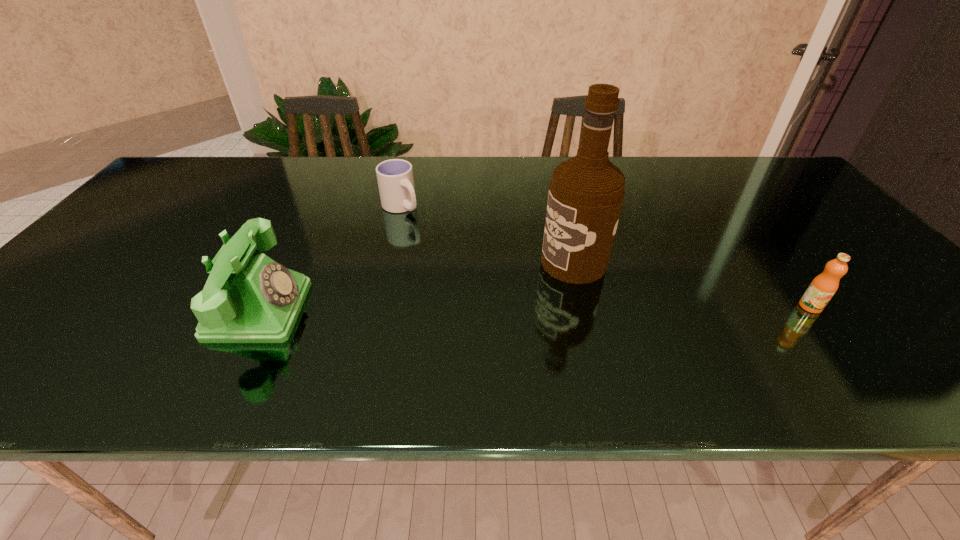
Locate an element on the screen. This screenshot has width=960, height=540. vacant area between the second tallest object and the orange juice is located at coordinates pyautogui.click(x=535, y=308).

Locate an element on the screen. The image size is (960, 540). unoccupied position between the alcohol and the rightmost object is located at coordinates [x=692, y=285].

Locate an element on the screen. This screenshot has width=960, height=540. vacant space that is in between the third shortest object and the third object from left to right is located at coordinates (417, 286).

Where is `free space between the second object from right to left and the shortest object`? This screenshot has width=960, height=540. free space between the second object from right to left and the shortest object is located at coordinates [487, 234].

Image resolution: width=960 pixels, height=540 pixels. What are the coordinates of `empty location between the cup and the third object from left to right` in the screenshot? It's located at (487, 234).

You are a GUI agent. You are given a task and a screenshot of the screen. Output one action in this format:
    pyautogui.click(x=<x>, y=<y>)
    Task: Click on the empty space that is in between the cup and the second tallest object
    The width and height of the screenshot is (960, 540).
    Given the screenshot: What is the action you would take?
    pyautogui.click(x=330, y=258)

Find the location of `vacant area that lies between the tallest object and the telephone`. vacant area that lies between the tallest object and the telephone is located at coordinates (417, 286).

Where is `unoccupied area between the third shortest object and the cup`? The image size is (960, 540). unoccupied area between the third shortest object and the cup is located at coordinates (330, 258).

Where is `object that is the closest one to the alcohol`? Image resolution: width=960 pixels, height=540 pixels. object that is the closest one to the alcohol is located at coordinates (395, 179).

Identify which object is located as the second nearest to the second object from right to left. Please provide its 2D coordinates. Your answer should be formatted as a tuple, i.e. [(x, y)], where the tuple contains the x and y coordinates of a point satisfying the conditions above.

[(823, 287)]